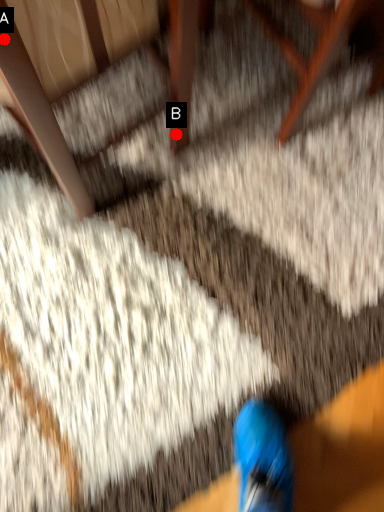
Question: Two points are circled on the image, labeled by A and B beside each circle. Which point is closer to the camera?

Choices:
 (A) A is closer
 (B) B is closer

Answer: (A)